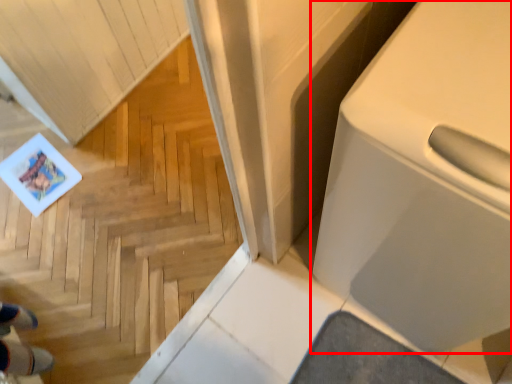
Question: From the image, what is the correct spatial relationship of home appliance (annotated by the red box) in relation to stairwell?

Choices:
 (A) left
 (B) right

Answer: (B)